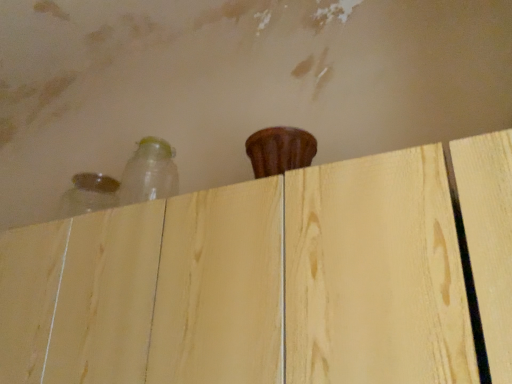
Question: Are transparent plastic bottle at upper left, the second bottle from the left, and translucent glass bottle at upper left, the 2th bottle when ordered from right to left, far apart?

Choices:
 (A) no
 (B) yes

Answer: (A)

Question: Can you confirm if transparent plastic bottle at upper left, marked as the 1th bottle in a right-to-left arrangement, is positioned to the left of translucent glass bottle at upper left, which appears as the 1th bottle when viewed from the left?

Choices:
 (A) no
 (B) yes

Answer: (A)

Question: Is transparent plastic bottle at upper left, the second bottle from the left, outside translucent glass bottle at upper left, which appears as the 1th bottle when viewed from the left?

Choices:
 (A) yes
 (B) no

Answer: (A)

Question: Is the depth of transparent plastic bottle at upper left, marked as the 1th bottle in a right-to-left arrangement, greater than that of translucent glass bottle at upper left, the 2th bottle when ordered from right to left?

Choices:
 (A) yes
 (B) no

Answer: (B)

Question: Does transparent plastic bottle at upper left, the second bottle from the left, have a larger size compared to translucent glass bottle at upper left, which appears as the 1th bottle when viewed from the left?

Choices:
 (A) no
 (B) yes

Answer: (B)

Question: Could you tell me if transparent plastic bottle at upper left, marked as the 1th bottle in a right-to-left arrangement, is facing translucent glass bottle at upper left, the 2th bottle when ordered from right to left?

Choices:
 (A) no
 (B) yes

Answer: (A)

Question: Can you confirm if light wood dresser at upper center is positioned to the left of transparent plastic bottle at upper left, the second bottle from the left?

Choices:
 (A) no
 (B) yes

Answer: (A)

Question: Can transparent plastic bottle at upper left, marked as the 1th bottle in a right-to-left arrangement, be found inside light wood dresser at upper center?

Choices:
 (A) no
 (B) yes

Answer: (A)

Question: Is light wood dresser at upper center facing towards transparent plastic bottle at upper left, marked as the 1th bottle in a right-to-left arrangement?

Choices:
 (A) no
 (B) yes

Answer: (A)

Question: Is light wood dresser at upper center to the right of transparent plastic bottle at upper left, marked as the 1th bottle in a right-to-left arrangement, from the viewer's perspective?

Choices:
 (A) yes
 (B) no

Answer: (A)

Question: Considering the relative sizes of light wood dresser at upper center and transparent plastic bottle at upper left, the second bottle from the left, in the image provided, is light wood dresser at upper center bigger than transparent plastic bottle at upper left, the second bottle from the left,?

Choices:
 (A) yes
 (B) no

Answer: (A)

Question: Considering the relative sizes of light wood dresser at upper center and transparent plastic bottle at upper left, the second bottle from the left, in the image provided, is light wood dresser at upper center smaller than transparent plastic bottle at upper left, the second bottle from the left,?

Choices:
 (A) yes
 (B) no

Answer: (B)

Question: From a real-world perspective, is light wood dresser at upper center physically above translucent glass bottle at upper left, which appears as the 1th bottle when viewed from the left?

Choices:
 (A) yes
 (B) no

Answer: (B)